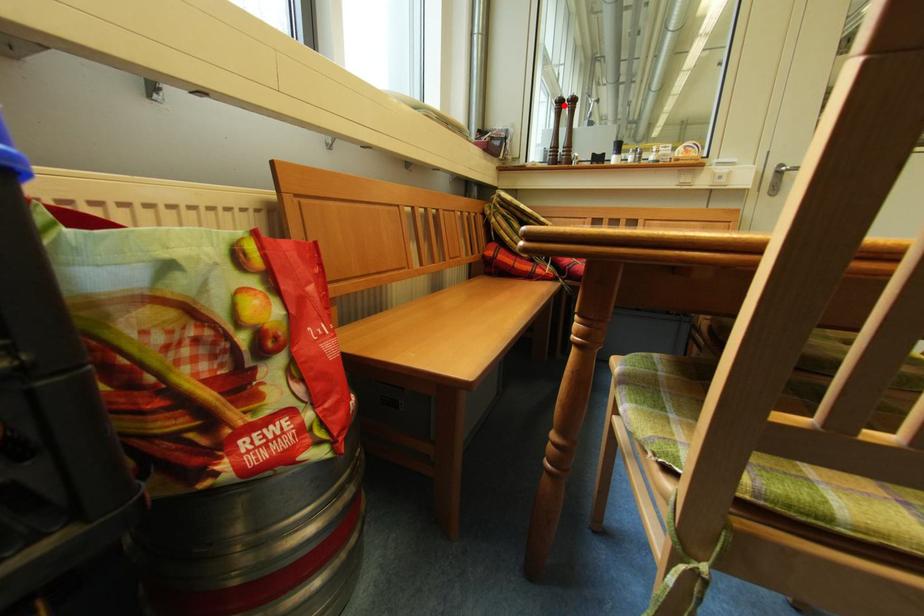
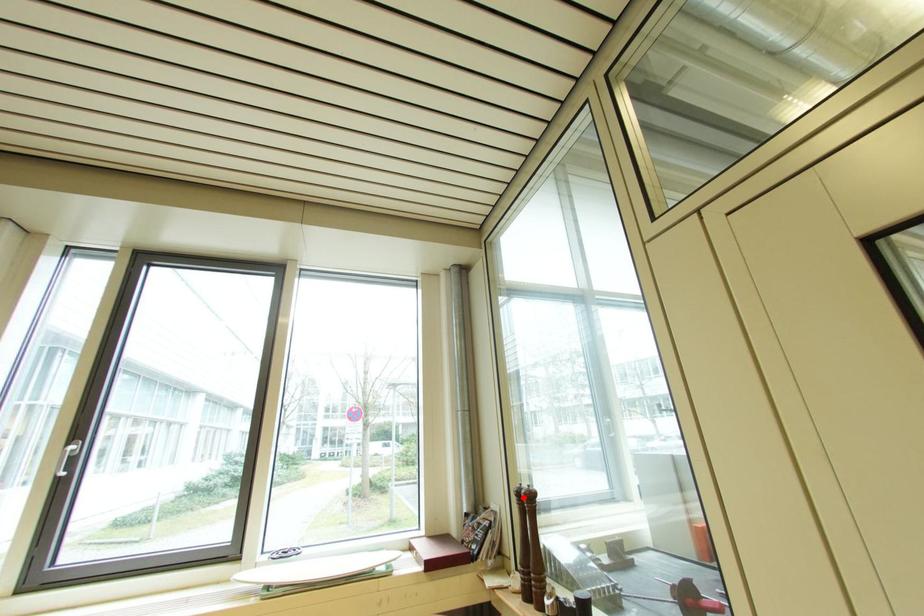
I am providing you with two images of the same scene from different viewpoints. A red point is marked on the first image and another point is marked on the second image. Does the point marked in image1 correspond to the same location as the one in image2?

Yes